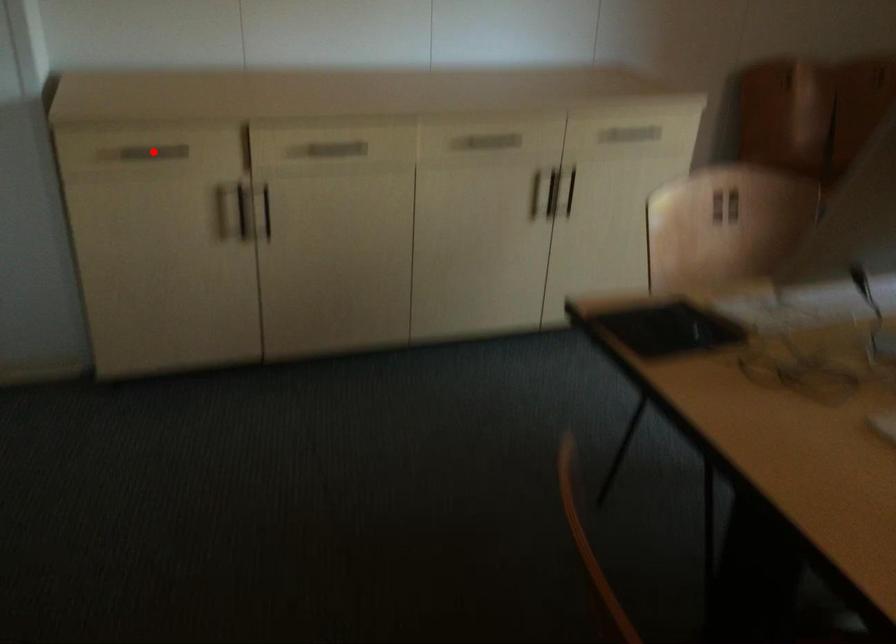
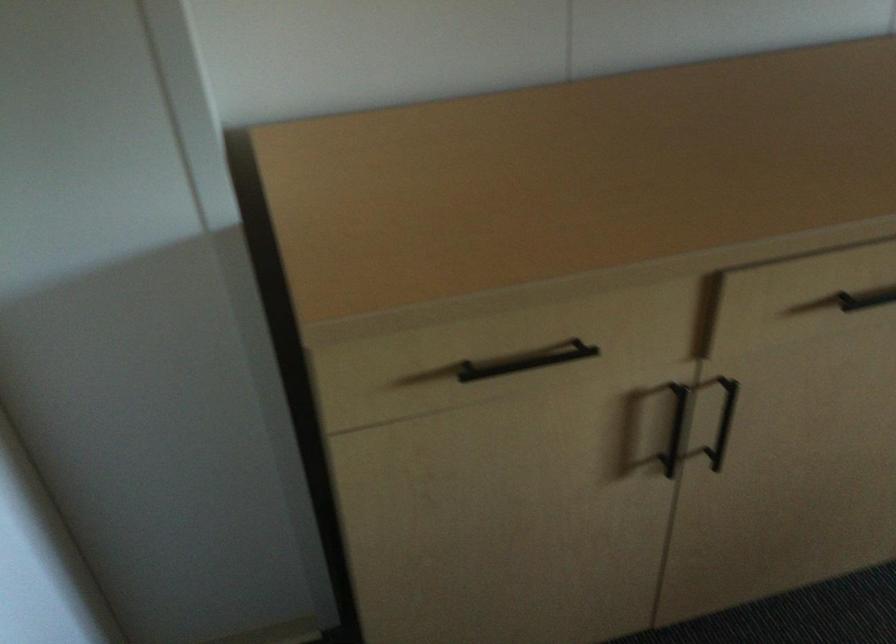
Question: I am providing you with two images of the same scene from different viewpoints. A red point is shown in image1. For the corresponding object point in image2, is it positioned nearer or farther from the camera?

Choices:
 (A) Nearer
 (B) Farther

Answer: (A)